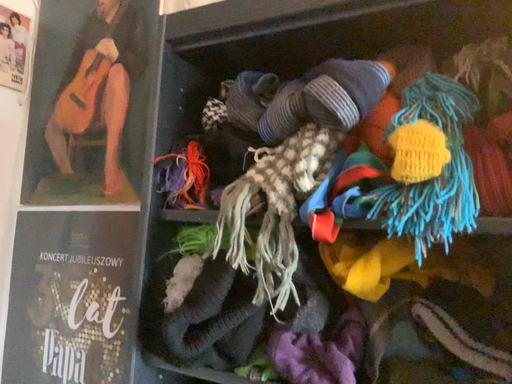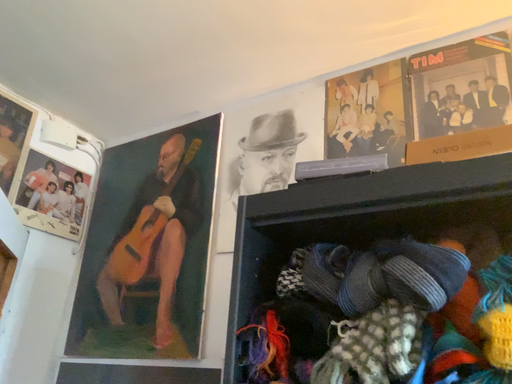
Question: How did the camera likely rotate when shooting the video?

Choices:
 (A) rotated downward
 (B) rotated upward

Answer: (B)